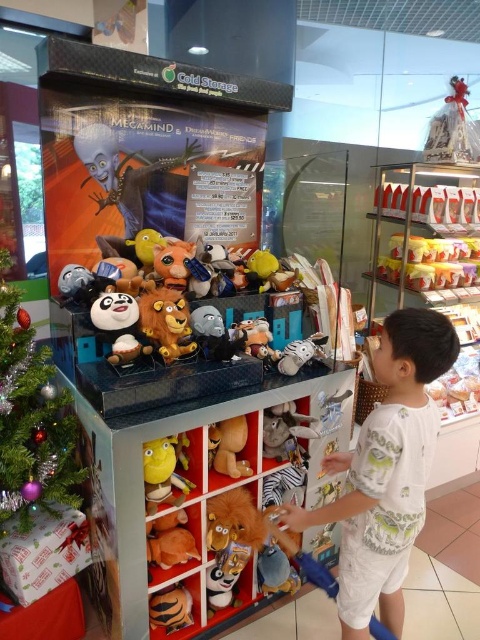
Based on the photo, who is more forward, (388, 404) or (180, 490)?

Positioned in front is point (388, 404).

Is white cotton shirt at center thinner than yellow plush toy at center?

In fact, white cotton shirt at center might be wider than yellow plush toy at center.

Locate an element on the screen. Image resolution: width=480 pixels, height=640 pixels. white cotton shirt at center is located at coordinates (385, 472).

Find the location of a particular element. brown plush toy at center is located at coordinates (228, 448).

Measure the distance between point (212, 440) and camera.

Point (212, 440) is 1.80 meters from camera.

Image resolution: width=480 pixels, height=640 pixels. What are the coordinates of `brown plush toy at center` in the screenshot? It's located at (228, 448).

Does fluffy orange plush lion at lower center appear over brown plush tiger at lower left?

Yes.

Is point (176, 548) more distant than point (152, 621)?

No, (176, 548) is closer to viewer.

Identify the location of fluffy orange plush lion at lower center. (169, 540).